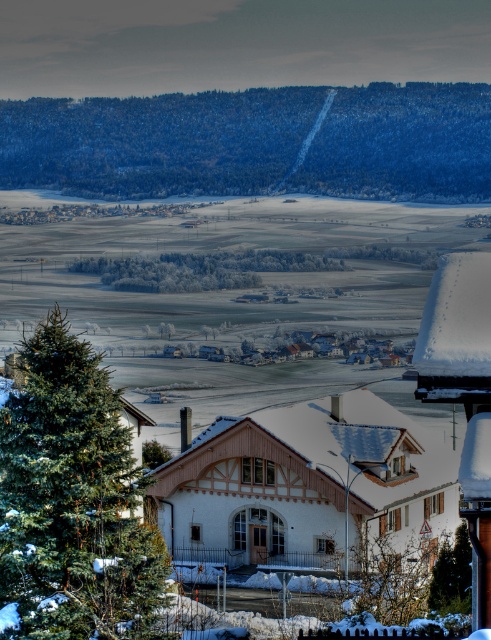
Question: Which object appears farthest from the camera in this image?

Choices:
 (A) white wooden house at center
 (B) green textured hillside at upper center

Answer: (B)

Question: Is green textured hillside at upper center behind white wooden house at center?

Choices:
 (A) no
 (B) yes

Answer: (B)

Question: Observing the image, what is the correct spatial positioning of green textured hillside at upper center in reference to white wooden house at center?

Choices:
 (A) above
 (B) below

Answer: (A)

Question: Is the position of green textured hillside at upper center less distant than that of white wooden house at center?

Choices:
 (A) yes
 (B) no

Answer: (B)